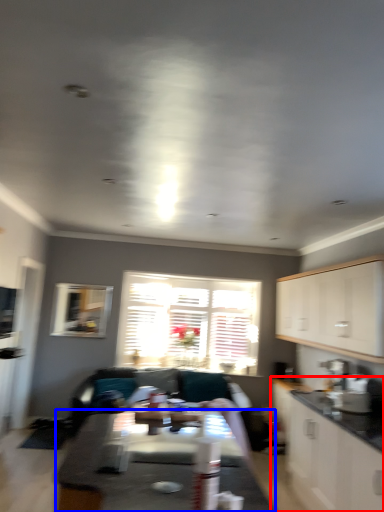
Question: Which point is closer to the camera, cabinetry (highlighted by a red box) or table (highlighted by a blue box)?

Choices:
 (A) cabinetry
 (B) table

Answer: (B)